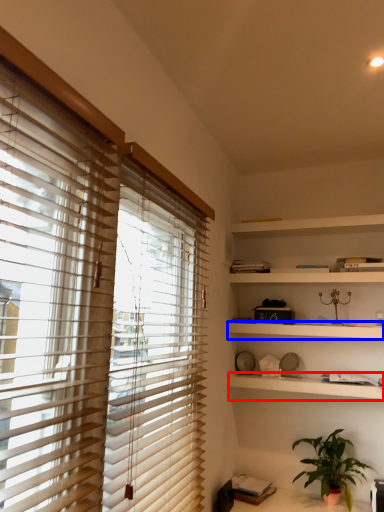
Question: Which point is further to the camera, shelf (highlighted by a red box) or shelf (highlighted by a blue box)?

Choices:
 (A) shelf
 (B) shelf

Answer: (B)